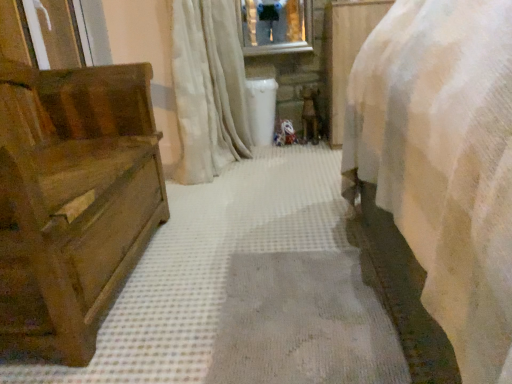
Question: Does white soft curtain at center have a greater width compared to wooden chest at left?

Choices:
 (A) no
 (B) yes

Answer: (A)

Question: From a real-world perspective, is white soft curtain at center over wooden chest at left?

Choices:
 (A) yes
 (B) no

Answer: (A)

Question: Is white soft curtain at center with wooden chest at left?

Choices:
 (A) yes
 (B) no

Answer: (B)

Question: Would you say white soft curtain at center is a long distance from wooden chest at left?

Choices:
 (A) no
 (B) yes

Answer: (A)

Question: Is white soft curtain at center bigger than wooden chest at left?

Choices:
 (A) yes
 (B) no

Answer: (B)

Question: Considering the relative sizes of white soft curtain at center and wooden chest at left in the image provided, is white soft curtain at center shorter than wooden chest at left?

Choices:
 (A) yes
 (B) no

Answer: (B)

Question: From a real-world perspective, does wooden chest at left stand above white soft curtain at center?

Choices:
 (A) yes
 (B) no

Answer: (B)

Question: Is wooden chest at left smaller than white soft curtain at center?

Choices:
 (A) no
 (B) yes

Answer: (A)

Question: Is wooden chest at left in front of white soft curtain at center?

Choices:
 (A) no
 (B) yes

Answer: (B)

Question: Could you tell me if wooden chest at left is facing white soft curtain at center?

Choices:
 (A) no
 (B) yes

Answer: (A)

Question: Is wooden chest at left positioned behind white soft curtain at center?

Choices:
 (A) no
 (B) yes

Answer: (A)

Question: Does wooden chest at left have a lesser width compared to white soft curtain at center?

Choices:
 (A) no
 (B) yes

Answer: (A)

Question: In the image, is white soft curtain at center positioned in front of or behind wooden chest at left?

Choices:
 (A) behind
 (B) front

Answer: (A)